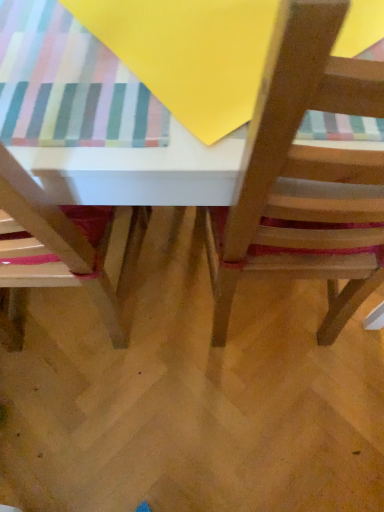
Question: Is wooden chair at lower left, which is the second chair in right-to-left order, facing towards wooden chair at center, placed as the second chair when sorted from left to right?

Choices:
 (A) no
 (B) yes

Answer: (A)

Question: Is wooden chair at lower left, which is the second chair in right-to-left order, positioned in front of wooden chair at center, which is the first chair in right-to-left order?

Choices:
 (A) yes
 (B) no

Answer: (B)

Question: From the image's perspective, is wooden chair at lower left, which appears as the 1th chair when viewed from the left, on wooden chair at center, placed as the second chair when sorted from left to right?

Choices:
 (A) yes
 (B) no

Answer: (B)

Question: Considering the relative positions of wooden chair at lower left, which is the second chair in right-to-left order, and wooden chair at center, which is the first chair in right-to-left order, in the image provided, is wooden chair at lower left, which is the second chair in right-to-left order, behind wooden chair at center, which is the first chair in right-to-left order,?

Choices:
 (A) no
 (B) yes

Answer: (B)

Question: From the image's perspective, is wooden chair at lower left, which appears as the 1th chair when viewed from the left, beneath wooden chair at center, placed as the second chair when sorted from left to right?

Choices:
 (A) no
 (B) yes

Answer: (B)

Question: Is the surface of wooden chair at lower left, which appears as the 1th chair when viewed from the left, in direct contact with wooden chair at center, placed as the second chair when sorted from left to right?

Choices:
 (A) no
 (B) yes

Answer: (A)

Question: Considering the relative positions of wooden chair at lower left, which appears as the 1th chair when viewed from the left, and wooden table at center in the image provided, is wooden chair at lower left, which appears as the 1th chair when viewed from the left, to the left of wooden table at center from the viewer's perspective?

Choices:
 (A) yes
 (B) no

Answer: (A)

Question: From a real-world perspective, does wooden chair at lower left, which is the second chair in right-to-left order, stand above wooden table at center?

Choices:
 (A) no
 (B) yes

Answer: (B)

Question: Considering the relative sizes of wooden chair at lower left, which appears as the 1th chair when viewed from the left, and wooden table at center in the image provided, is wooden chair at lower left, which appears as the 1th chair when viewed from the left, bigger than wooden table at center?

Choices:
 (A) yes
 (B) no

Answer: (B)

Question: Is wooden chair at lower left, which is the second chair in right-to-left order, smaller than wooden table at center?

Choices:
 (A) no
 (B) yes

Answer: (B)

Question: Is wooden chair at lower left, which appears as the 1th chair when viewed from the left, positioned far away from wooden table at center?

Choices:
 (A) no
 (B) yes

Answer: (A)

Question: Is wooden chair at lower left, which is the second chair in right-to-left order, completely or partially outside of wooden table at center?

Choices:
 (A) no
 (B) yes

Answer: (A)

Question: Could wooden chair at center, placed as the second chair when sorted from left to right, be considered to be inside wooden table at center?

Choices:
 (A) no
 (B) yes

Answer: (B)